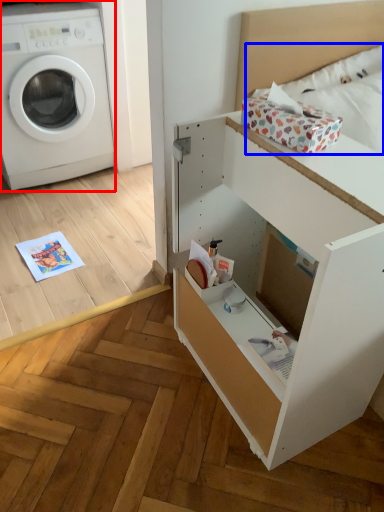
Question: Which point is further to the camera, washing machine (highlighted by a red box) or bedding (highlighted by a blue box)?

Choices:
 (A) washing machine
 (B) bedding

Answer: (A)